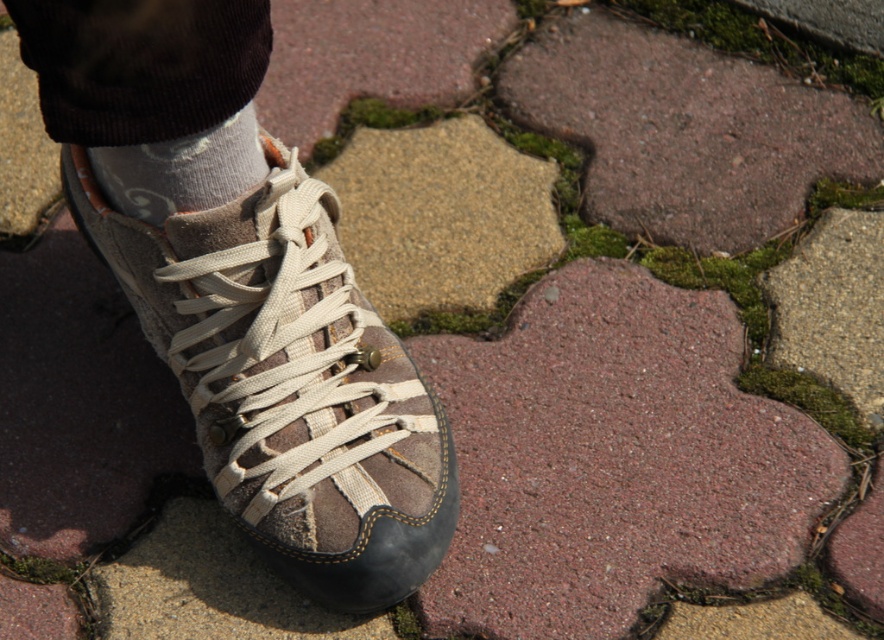
You are a photographer trying to capture the brown suede boot at center in your shot. If your camera is focused at point 0.5, 0.5, will the boot be in focus?

The brown suede boot at center is located at point (288, 381), which is close to the camera focus point (442, 320). Therefore, the boot will be in focus.